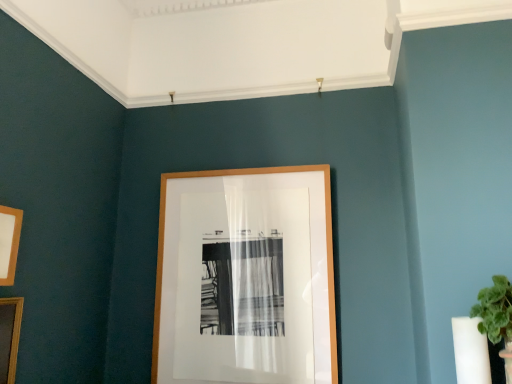
Question: Considering the positions of wooden picture frame at left, acting as the second picture frame starting from the front, and wooden picture frame at lower left, the first picture frame positioned from the left, in the image, is wooden picture frame at left, acting as the second picture frame starting from the front, taller or shorter than wooden picture frame at lower left, the first picture frame positioned from the left,?

Choices:
 (A) short
 (B) tall

Answer: (A)

Question: Do you think wooden picture frame at left, acting as the second picture frame starting from the front, is within wooden picture frame at lower left, which is counted as the 3th picture frame, starting from the back, or outside of it?

Choices:
 (A) inside
 (B) outside

Answer: (B)

Question: Estimate the real-world distances between objects in this image. Which object is closer to the wooden picture frame at left, the 2th picture frame in the left-to-right sequence?

Choices:
 (A) wooden picture frame at lower left, which is the first picture frame from front to back
 (B) wooden picture frame at center, positioned as the third picture frame in left-to-right order

Answer: (A)

Question: Which of these objects is positioned farthest from the wooden picture frame at left, which is the second picture frame in right-to-left order?

Choices:
 (A) wooden picture frame at center, positioned as the third picture frame in left-to-right order
 (B) wooden picture frame at lower left, the first picture frame positioned from the left

Answer: (A)